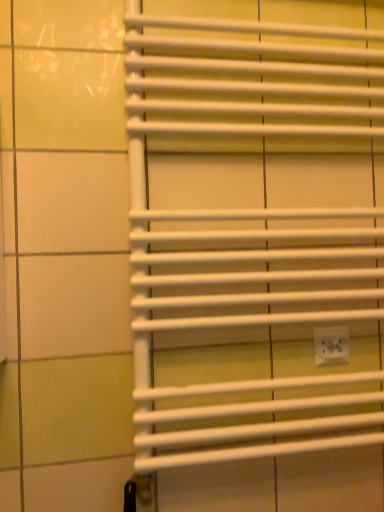
Question: Is white plastic electric outlet at lower right wider or thinner than white matte towel rack at center?

Choices:
 (A) thin
 (B) wide

Answer: (A)

Question: Relative to white matte towel rack at center, is white plastic electric outlet at lower right in front or behind?

Choices:
 (A) behind
 (B) front

Answer: (A)

Question: Is point (321, 357) positioned closer to the camera than point (248, 108)?

Choices:
 (A) closer
 (B) farther

Answer: (B)

Question: Relative to white plastic electric outlet at lower right, is white matte towel rack at center in front or behind?

Choices:
 (A) behind
 (B) front

Answer: (B)

Question: From the image's perspective, is white matte towel rack at center located above or below white plastic electric outlet at lower right?

Choices:
 (A) above
 (B) below

Answer: (A)

Question: From a real-world perspective, is white matte towel rack at center physically located above or below white plastic electric outlet at lower right?

Choices:
 (A) below
 (B) above

Answer: (B)

Question: Looking at the image, does white matte towel rack at center seem bigger or smaller compared to white plastic electric outlet at lower right?

Choices:
 (A) small
 (B) big

Answer: (B)